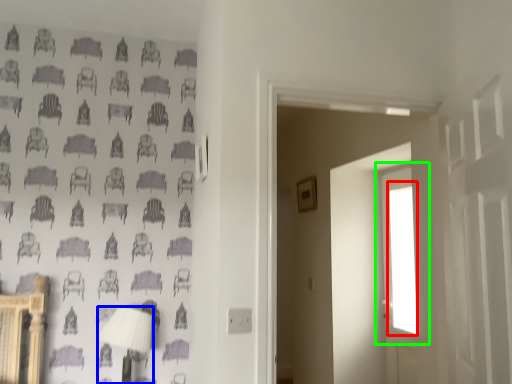
Question: Which object is the farthest from window (highlighted by a red box)? Choose among these: table lamp (highlighted by a blue box) or window (highlighted by a green box).

Choices:
 (A) table lamp
 (B) window

Answer: (A)